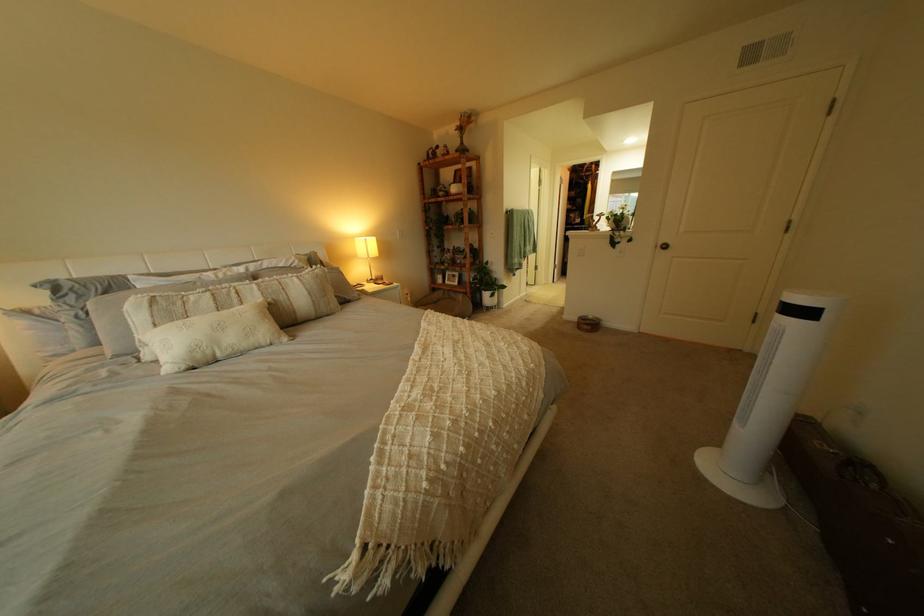
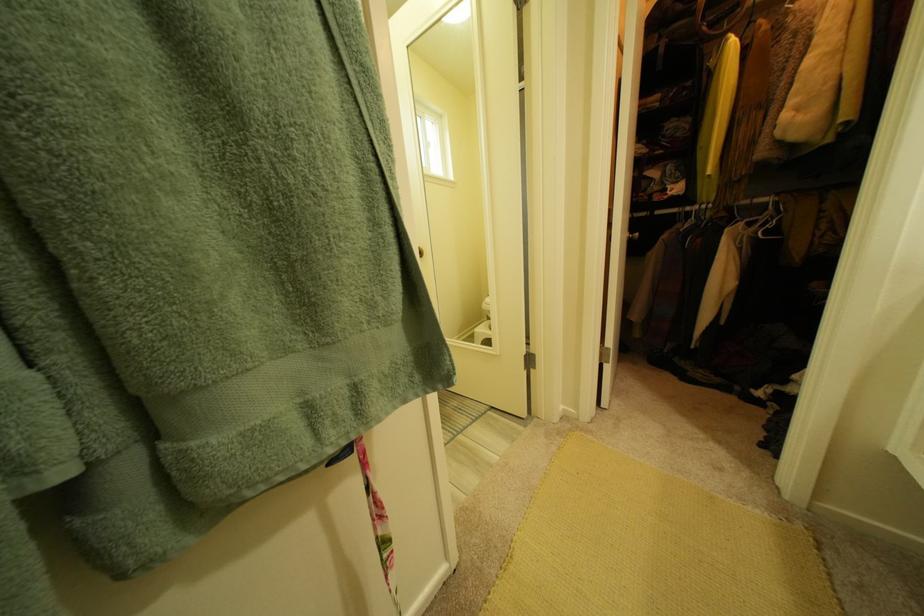
In a continuous first-person perspective shot, in which direction is the camera moving?

The movement direction of the cameraman is right, forward.